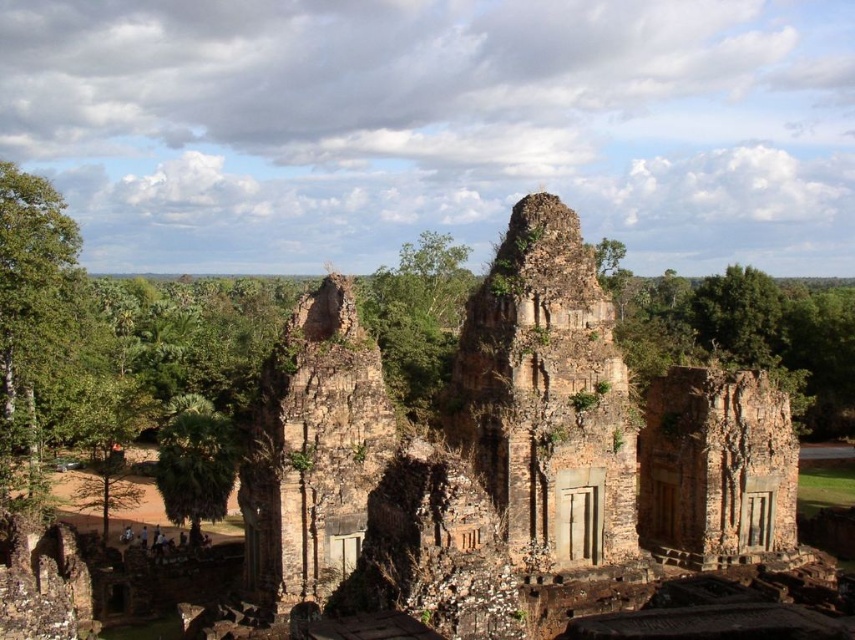
You are an archaeologist examining the ancient site. You notice the brown stone ruins at center and the green leafy palm tree at lower left. Which object is located to the right of the other?

The brown stone ruins at center is positioned on the right side of green leafy palm tree at lower left.

You are an archaeologist examining the ancient site. You notice the brown stone ruins at center and the green leafy palm tree at lower left. Which structure is taller?

The brown stone ruins at center is much taller than the green leafy palm tree at lower left.